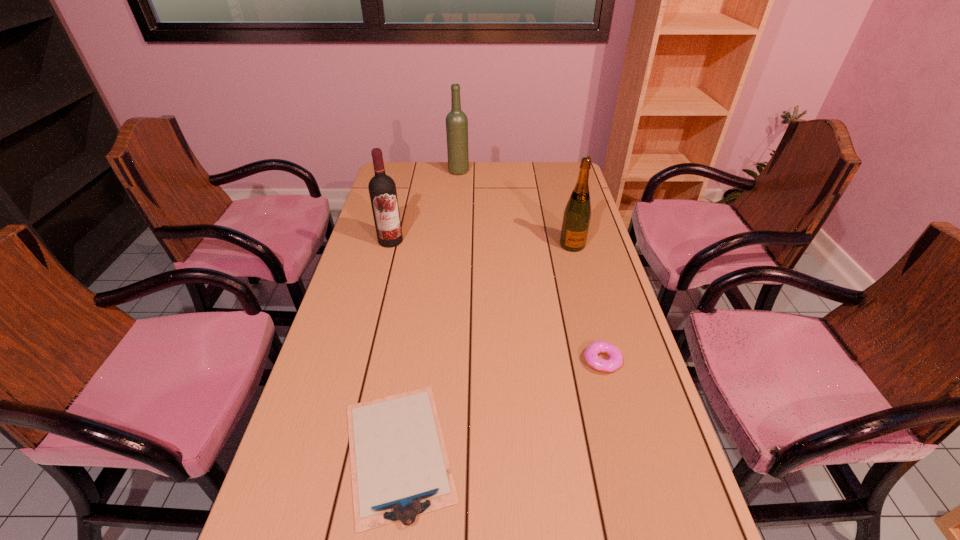
Find the location of a particular element. The height and width of the screenshot is (540, 960). free spot located on the front-facing side of the rightmost wine bottle is located at coordinates (584, 287).

What are the coordinates of `vacant area situated on the left of the doughnut` in the screenshot? It's located at (525, 361).

Identify the location of vacant space located on the back of the nearest object. (420, 301).

The height and width of the screenshot is (540, 960). Find the location of `object positioned at the far edge`. object positioned at the far edge is located at coordinates (456, 121).

This screenshot has height=540, width=960. In order to click on wine bottle present at the left edge in this screenshot , I will do `click(382, 189)`.

Image resolution: width=960 pixels, height=540 pixels. In order to click on clipboard positioned at the left edge in this screenshot , I will do point(400,469).

Find the location of `wine bottle that is at the right edge`. wine bottle that is at the right edge is located at coordinates (576, 219).

At what (x,y) coordinates should I click in order to perform the action: click on doughnut located in the right edge section of the desktop. Please return your answer as a coordinate pair (x, y). Looking at the image, I should click on (591, 353).

Locate an element on the screen. Image resolution: width=960 pixels, height=540 pixels. blank space at the far edge of the desktop is located at coordinates (506, 163).

Identify the location of free space at the left edge of the desktop. (358, 341).